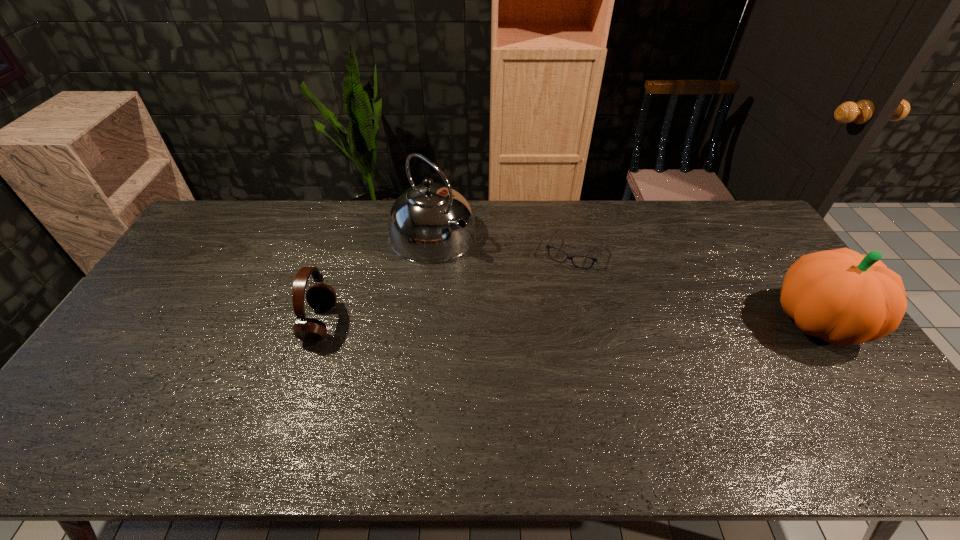
This screenshot has width=960, height=540. What are the coordinates of `vacant space situated on the front-facing side of the shortest object` in the screenshot? It's located at (525, 359).

This screenshot has height=540, width=960. Find the location of `free region located 0.200m from the spout of the third object from right to left`. free region located 0.200m from the spout of the third object from right to left is located at coordinates (501, 289).

The width and height of the screenshot is (960, 540). I want to click on vacant space situated 0.080m from the spout of the third object from right to left, so click(476, 269).

Image resolution: width=960 pixels, height=540 pixels. What are the coordinates of `free space located from the spout of the third object from right to left` in the screenshot? It's located at (503, 291).

At what (x,y) coordinates should I click in order to perform the action: click on spectacles that is at the far edge. Please return your answer as a coordinate pair (x, y). The image size is (960, 540). Looking at the image, I should click on (548, 246).

Image resolution: width=960 pixels, height=540 pixels. In order to click on kettle that is at the far edge in this screenshot , I will do `click(430, 223)`.

This screenshot has height=540, width=960. I want to click on object that is positioned at the right edge, so click(x=840, y=296).

Identify the location of blank area at the far edge. This screenshot has width=960, height=540. (534, 225).

Identify the location of free space at the near edge of the desktop. (249, 395).

In the image, there is a desktop. Where is `vacant space at the left edge`? vacant space at the left edge is located at coordinates (130, 361).